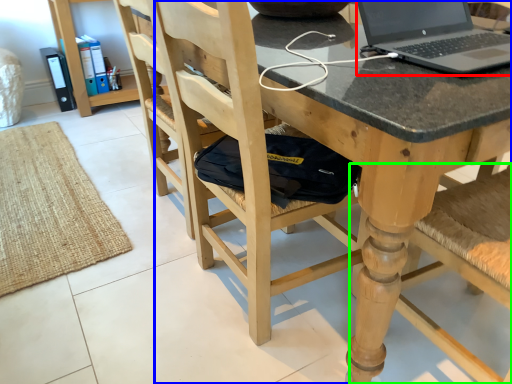
Question: Which is farther away from laptop (highlighted by a red box)? chair (highlighted by a blue box) or chair (highlighted by a green box)?

Choices:
 (A) chair
 (B) chair

Answer: (B)